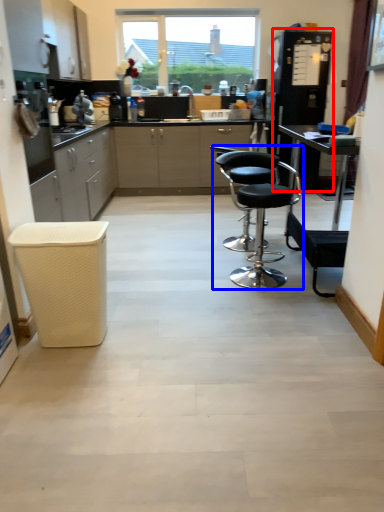
Question: Which point is further to the camera, appliance (highlighted by a red box) or chair (highlighted by a blue box)?

Choices:
 (A) appliance
 (B) chair

Answer: (A)